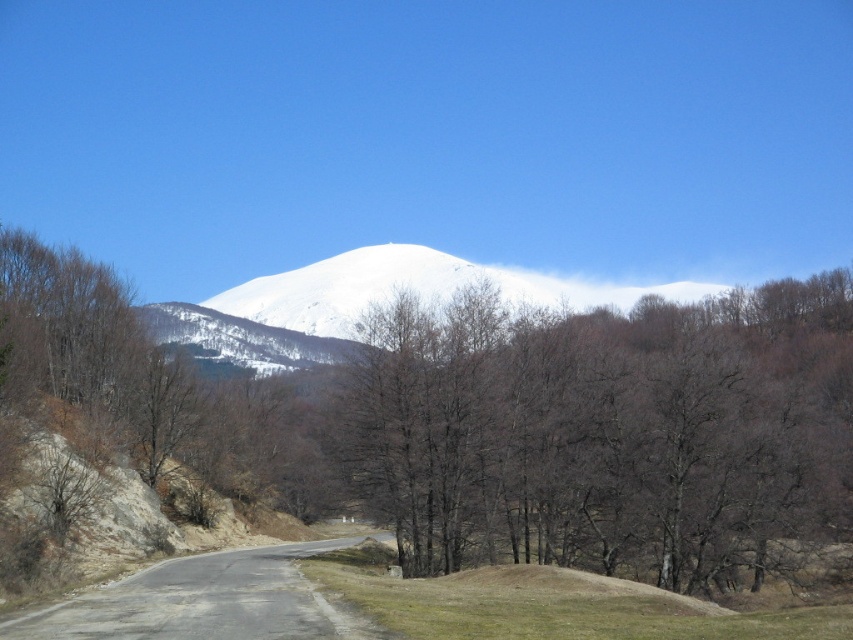
Between brown/dry wood trees at center and white snow-covered mountain at center, which one has less height?

brown/dry wood trees at center

Does brown/dry wood trees at center have a greater width compared to white snow-covered mountain at center?

Incorrect, brown/dry wood trees at center's width does not surpass white snow-covered mountain at center's.

Is point (549, 323) more distant than point (209, 317)?

No, (549, 323) is closer to viewer.

This screenshot has width=853, height=640. I want to click on brown/dry wood trees at center, so click(608, 433).

Between brown/dry wood trees at center and gray asphalt road at lower left, which one appears on the right side from the viewer's perspective?

brown/dry wood trees at center is more to the right.

Is point (613, 435) behind point (151, 632)?

That is True.

Which is in front, point (727, 545) or point (102, 634)?

Point (102, 634) is in front.

Where is `brown/dry wood trees at center`? brown/dry wood trees at center is located at coordinates (608, 433).

Can you confirm if white snow-covered mountain at center is positioned to the left of gray asphalt road at lower left?

Incorrect, white snow-covered mountain at center is not on the left side of gray asphalt road at lower left.

Looking at this image, which is more to the right, white snow-covered mountain at center or gray asphalt road at lower left?

Positioned to the right is white snow-covered mountain at center.

The height and width of the screenshot is (640, 853). I want to click on white snow-covered mountain at center, so click(364, 304).

Locate an element on the screen. white snow-covered mountain at center is located at coordinates (364, 304).